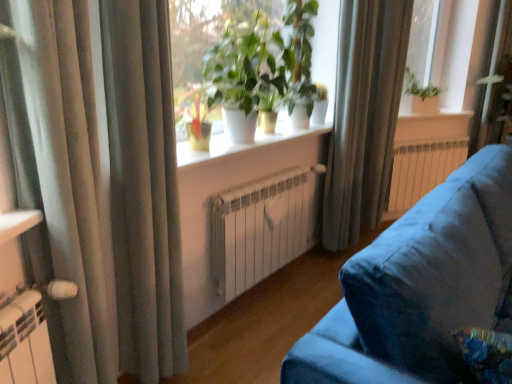
Question: Does velvet blue couch at lower right have a greater width compared to silky gray curtain at upper right, the first curtain positioned from the right?

Choices:
 (A) no
 (B) yes

Answer: (B)

Question: Is velvet blue couch at lower right completely or partially outside of silky gray curtain at upper right, marked as the 1th curtain in a back-to-front arrangement?

Choices:
 (A) yes
 (B) no

Answer: (A)

Question: Is velvet blue couch at lower right oriented away from silky gray curtain at upper right, which appears as the third curtain when viewed from the front?

Choices:
 (A) yes
 (B) no

Answer: (A)

Question: Is velvet blue couch at lower right further to the viewer compared to silky gray curtain at upper right, placed as the 3th curtain when sorted from left to right?

Choices:
 (A) no
 (B) yes

Answer: (A)

Question: Is velvet blue couch at lower right at the right side of silky gray curtain at upper right, placed as the 3th curtain when sorted from left to right?

Choices:
 (A) yes
 (B) no

Answer: (A)

Question: Is green glossy plant at upper center taller or shorter than satin fabric curtain at left, the first curtain from the left?

Choices:
 (A) short
 (B) tall

Answer: (A)

Question: Does point (303, 87) appear closer or farther from the camera than point (130, 347)?

Choices:
 (A) farther
 (B) closer

Answer: (A)

Question: From the image's perspective, relative to satin fabric curtain at left, which is counted as the 3th curtain, starting from the back, is green glossy plant at upper center above or below?

Choices:
 (A) above
 (B) below

Answer: (A)

Question: Considering the relative positions of green glossy plant at upper center and satin fabric curtain at left, marked as the 1th curtain in a front-to-back arrangement, in the image provided, is green glossy plant at upper center to the left or to the right of satin fabric curtain at left, marked as the 1th curtain in a front-to-back arrangement,?

Choices:
 (A) left
 (B) right

Answer: (B)

Question: Relative to white metallic radiator at center, which is the second radiator in right-to-left order, is white glossy window sill at center, which is counted as the second window sill, starting from the bottom, in front or behind?

Choices:
 (A) front
 (B) behind

Answer: (B)

Question: Does point (406, 114) appear closer or farther from the camera than point (274, 259)?

Choices:
 (A) closer
 (B) farther

Answer: (B)

Question: From their relative heights in the image, would you say white glossy window sill at center, positioned as the first window sill in top-to-bottom order, is taller or shorter than white metallic radiator at center, the 2th radiator when ordered from back to front?

Choices:
 (A) tall
 (B) short

Answer: (B)

Question: Is white glossy window sill at center, which is the second window sill from front to back, bigger or smaller than white metallic radiator at center, the 1th radiator viewed from the left?

Choices:
 (A) small
 (B) big

Answer: (A)

Question: From the image's perspective, is white glossy pot at center positioned above or below silky gray curtain at left, the 2th curtain from the front?

Choices:
 (A) above
 (B) below

Answer: (A)

Question: Is white glossy pot at center bigger or smaller than silky gray curtain at left, which is the second curtain in left-to-right order?

Choices:
 (A) small
 (B) big

Answer: (B)